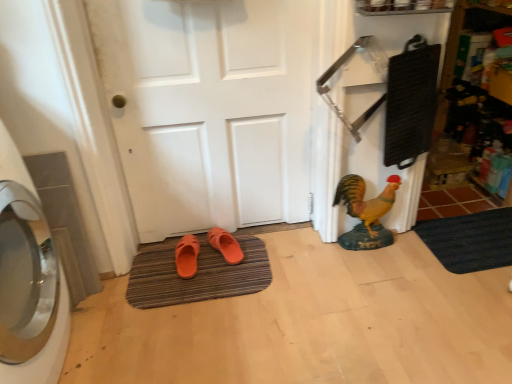
Identify the location of free spot below black rubber bath mat at lower right, marked as the second bath mat in a left-to-right arrangement (from a real-world perspective). (474, 242).